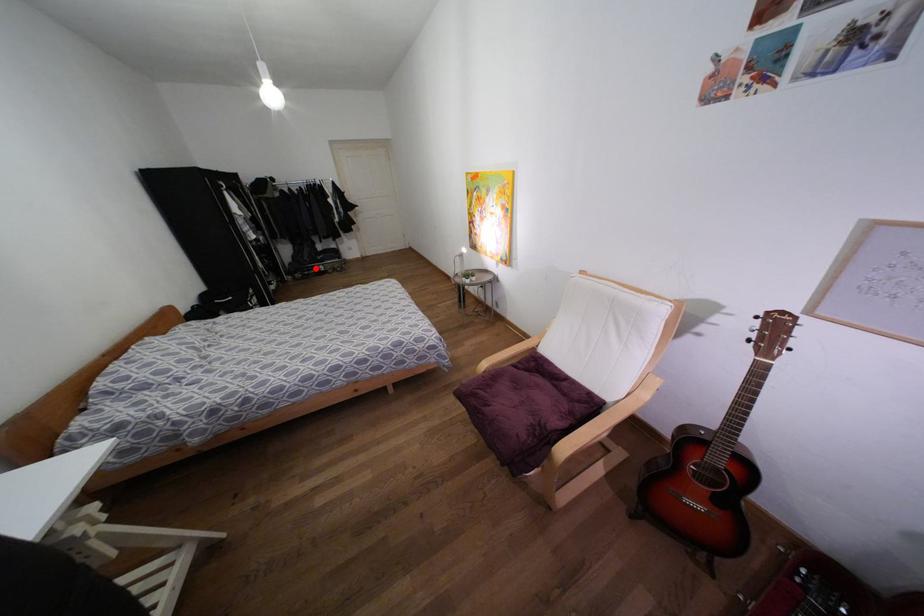
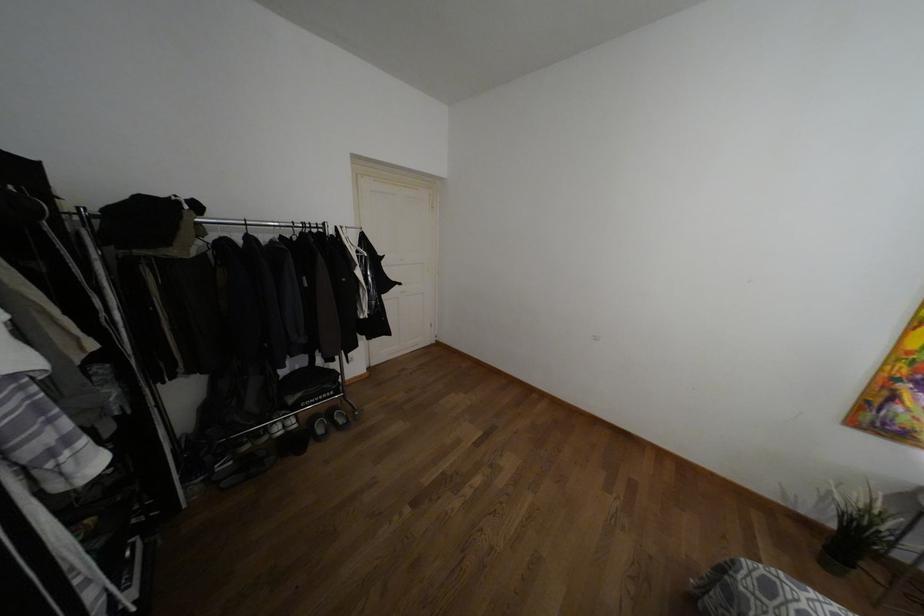
Locate, in the second image, the point that corresponds to the highlighted location in the first image.

(275, 427)